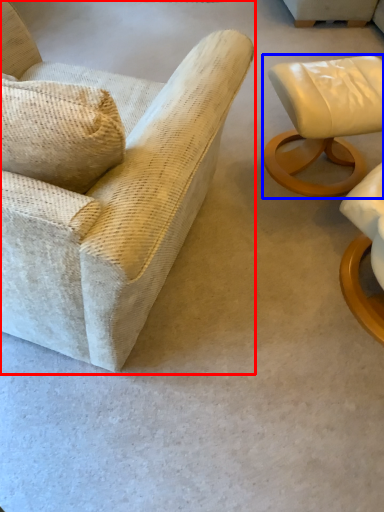
Question: Among these objects, which one is nearest to the camera, chair (highlighted by a red box) or chair (highlighted by a blue box)?

Choices:
 (A) chair
 (B) chair

Answer: (A)